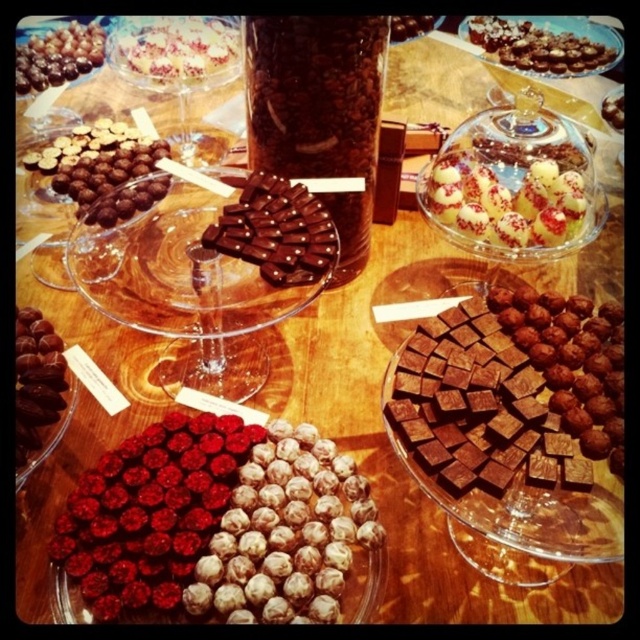
You are a customer at a chocolate shop and want to choose a dessert. You see the white textured cake at upper left and the shiny dark chocolate at bottom left. Which one has a greater width?

The white textured cake at upper left has a greater width than the shiny dark chocolate at bottom left.